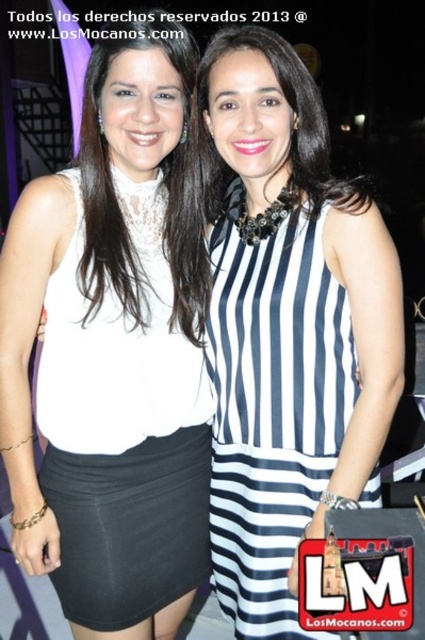
You are at the coordinates 0.5, 0.5 in the image. Which direction should you move to reach the white lace dress at left?

Since the white lace dress at left is located at point (124, 429), you should move northeast to reach it from your current position at (212, 320).

You are a photographer at a social event and want to ensure both the white lace dress at left and the navy blue striped dress at center are clearly visible in your photo. Based on their positions, which dress might be partially obscured and why?

The navy blue striped dress at center might be partially obscured because the white lace dress at left is in front of it, potentially blocking part of the view.

You are standing in front of the two women at the social event. You want to take a photo of them from a distance that ensures both are in focus. The camera you are using has a depth of field that can cover 1.5 meters. Is the distance from the camera to the point at coordinates point [79,230] within the camera depth of field?

The point at coordinates point [79,230] is 1.45 meters from the camera, which is within the camera depth of field of 1.5 meters. Therefore, the distance is acceptable for both women to be in focus.